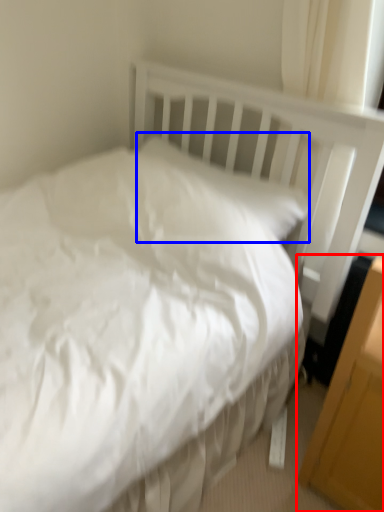
Question: Which object is closer to the camera taking this photo, file cabinet (highlighted by a red box) or pillow (highlighted by a blue box)?

Choices:
 (A) file cabinet
 (B) pillow

Answer: (A)